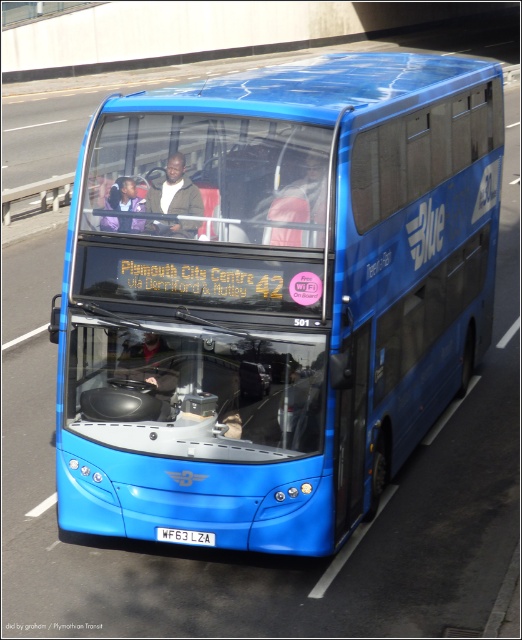
Is blue metallic bus at center further to the viewer compared to white matte license plate at center?

That is False.

Identify the location of blue metallic bus at center. The height and width of the screenshot is (640, 522). (275, 296).

Between point (254, 211) and point (196, 541), which one is positioned behind?

The point (196, 541) is behind.

Locate an element on the screen. blue metallic bus at center is located at coordinates (275, 296).

Does blue metallic bus at center have a lesser width compared to khaki fabric jacket at center?

No, blue metallic bus at center is not thinner than khaki fabric jacket at center.

Is blue metallic bus at center bigger than khaki fabric jacket at center?

Yes.

Image resolution: width=522 pixels, height=640 pixels. I want to click on blue metallic bus at center, so click(x=275, y=296).

Which of these two, khaki fabric jacket at center or white matte license plate at center, stands taller?

khaki fabric jacket at center is taller.

Is point (170, 176) more distant than point (206, 538)?

No.

Who is more forward, [186,230] or [207,545]?

Positioned in front is point [186,230].

This screenshot has width=522, height=640. I want to click on khaki fabric jacket at center, so click(173, 189).